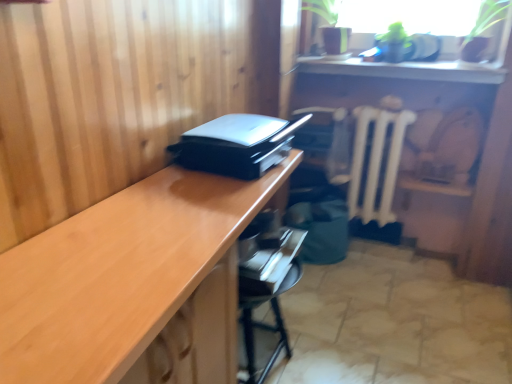
Question: Is glossy wood desk at center looking in the opposite direction of black plastic drawer at center?

Choices:
 (A) no
 (B) yes

Answer: (A)

Question: Is glossy wood desk at center positioned beyond the bounds of black plastic drawer at center?

Choices:
 (A) yes
 (B) no

Answer: (A)

Question: Is glossy wood desk at center smaller than black plastic drawer at center?

Choices:
 (A) yes
 (B) no

Answer: (B)

Question: From a real-world perspective, is glossy wood desk at center on top of black plastic drawer at center?

Choices:
 (A) no
 (B) yes

Answer: (A)

Question: Is black plastic drawer at center surrounded by glossy wood desk at center?

Choices:
 (A) no
 (B) yes

Answer: (A)

Question: From the image's perspective, is glossy wood desk at center over black plastic drawer at center?

Choices:
 (A) yes
 (B) no

Answer: (B)

Question: Is black plastic drawer at center directly adjacent to metallic black drawer at lower center?

Choices:
 (A) no
 (B) yes

Answer: (A)

Question: Can you confirm if black plastic drawer at center is smaller than metallic black drawer at lower center?

Choices:
 (A) yes
 (B) no

Answer: (A)

Question: Is black plastic drawer at center wider than metallic black drawer at lower center?

Choices:
 (A) yes
 (B) no

Answer: (B)

Question: Is the depth of black plastic drawer at center greater than that of metallic black drawer at lower center?

Choices:
 (A) yes
 (B) no

Answer: (A)

Question: From the image's perspective, is black plastic drawer at center beneath metallic black drawer at lower center?

Choices:
 (A) yes
 (B) no

Answer: (B)

Question: Considering the relative positions of black plastic drawer at center and metallic black drawer at lower center in the image provided, is black plastic drawer at center in front of metallic black drawer at lower center?

Choices:
 (A) no
 (B) yes

Answer: (A)

Question: From a real-world perspective, is black plastic printer at center located higher than white matte radiator at center?

Choices:
 (A) yes
 (B) no

Answer: (A)